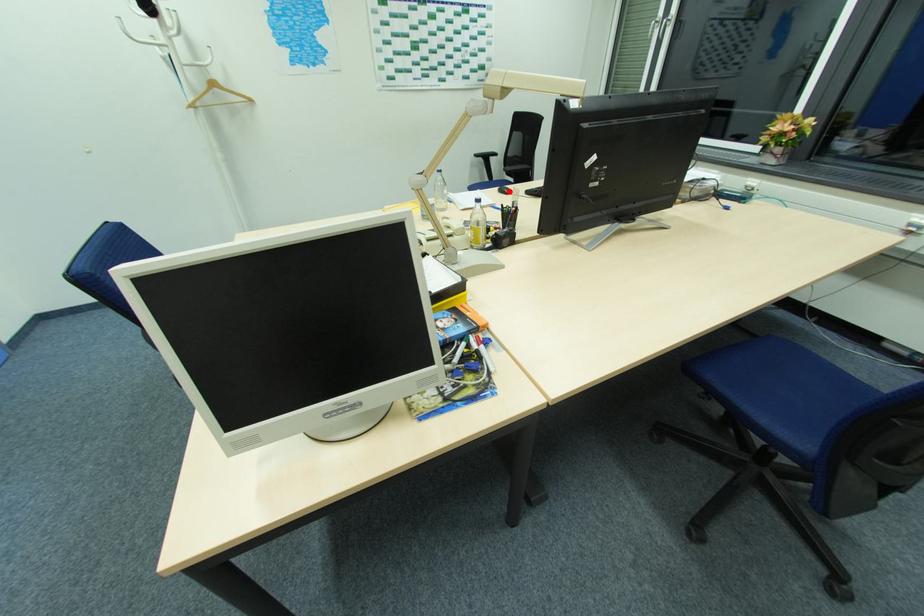
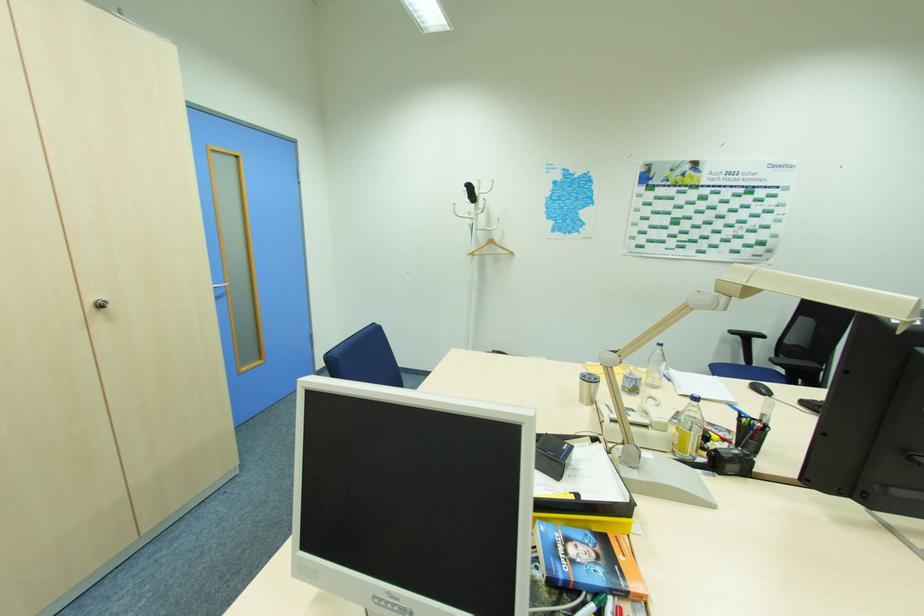
In the second image, find the point that corresponds to the highlighted location in the first image.

(767, 391)